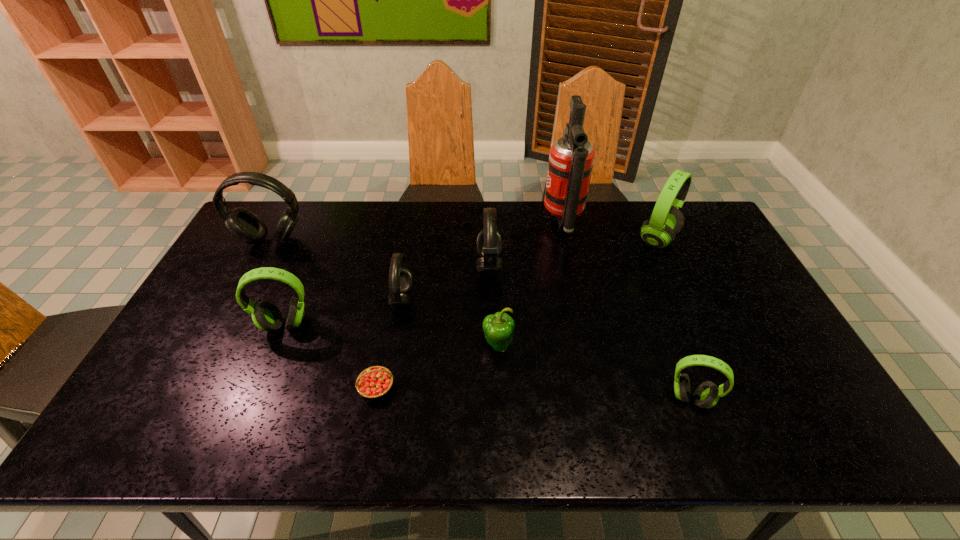
At what (x,y) coordinates should I click in order to perform the action: click on object present at the right edge. Please return your answer as a coordinate pair (x, y). Image resolution: width=960 pixels, height=540 pixels. Looking at the image, I should click on (666, 221).

Locate an element on the screen. This screenshot has width=960, height=540. object that is at the far left corner is located at coordinates (243, 224).

Image resolution: width=960 pixels, height=540 pixels. What are the coordinates of `object that is at the far right corner` in the screenshot? It's located at 666,221.

This screenshot has width=960, height=540. What are the coordinates of `vacant space at the far edge of the desktop` in the screenshot? It's located at (612, 219).

The height and width of the screenshot is (540, 960). Identify the location of vacant area at the near edge. (421, 450).

In the image, there is a desktop. Where is `vacant space at the right edge`? The height and width of the screenshot is (540, 960). vacant space at the right edge is located at coordinates (809, 408).

This screenshot has height=540, width=960. In the image, there is a desktop. In order to click on vacant space at the far left corner in this screenshot , I will do `click(281, 215)`.

Locate an element on the screen. Image resolution: width=960 pixels, height=540 pixels. free space at the far right corner of the desktop is located at coordinates (724, 239).

Find the location of `free spot between the strawberry and the second smallest gray headset`. free spot between the strawberry and the second smallest gray headset is located at coordinates (433, 327).

Image resolution: width=960 pixels, height=540 pixels. What are the coordinates of `free spot between the red fire extinguisher and the nearest green headset` in the screenshot? It's located at (627, 309).